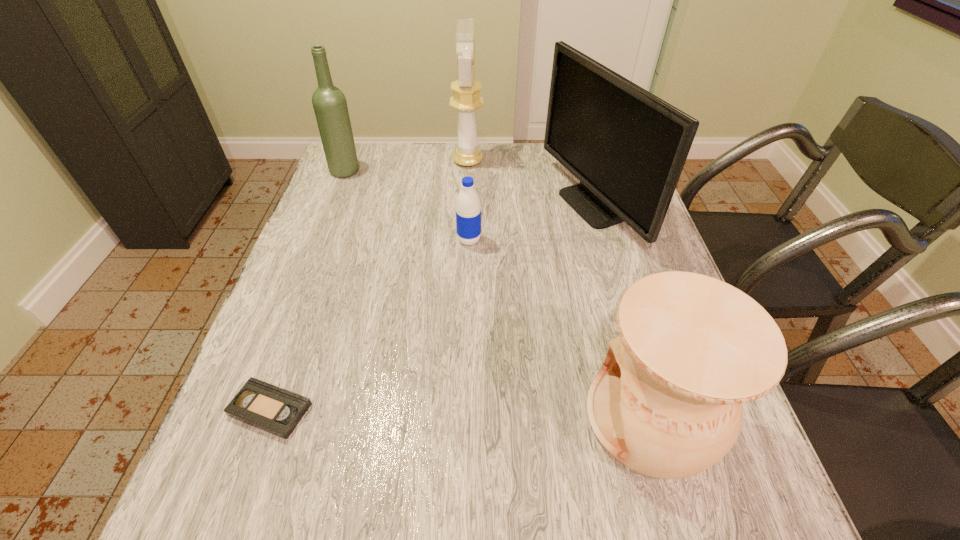
Image resolution: width=960 pixels, height=540 pixels. In order to click on vacant region at the right edge of the desktop in this screenshot , I will do `click(656, 242)`.

In the image, there is a desktop. Where is `vacant space at the far left corner`? This screenshot has height=540, width=960. vacant space at the far left corner is located at coordinates (380, 182).

Find the location of a particular element. Image resolution: width=960 pixels, height=540 pixels. vacant area that lies between the shortest object and the wine bottle is located at coordinates (308, 290).

Where is `unoccupied position between the award and the third shortest object`? The width and height of the screenshot is (960, 540). unoccupied position between the award and the third shortest object is located at coordinates (560, 289).

Locate an element on the screen. vacant space in between the second shortest object and the third shortest object is located at coordinates (561, 328).

Where is `vacant area that lies between the fourth tallest object and the award`? The width and height of the screenshot is (960, 540). vacant area that lies between the fourth tallest object and the award is located at coordinates (560, 289).

The height and width of the screenshot is (540, 960). In order to click on free spot between the wine bottle and the award in this screenshot , I will do (407, 166).

Find the location of a particular element. vacant space in between the third shortest object and the shortest object is located at coordinates (461, 413).

What are the coordinates of `free spot between the third shortest object and the water bottle` in the screenshot? It's located at (561, 328).

The height and width of the screenshot is (540, 960). In order to click on empty space that is in between the videotape and the wine bottle in this screenshot , I will do `click(308, 290)`.